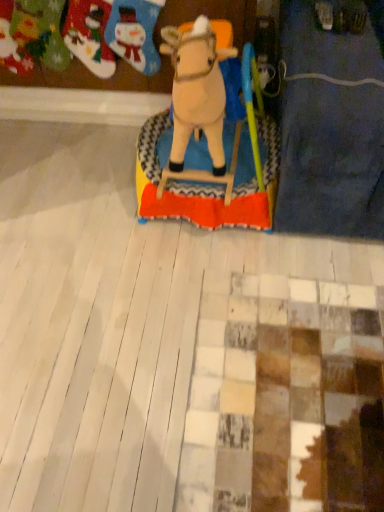
Locate an element on the screen. This screenshot has height=512, width=384. vacant region below felt stockings at upper left, placed as the first toy when sorted from left to right (from a real-world perspective) is located at coordinates (104, 132).